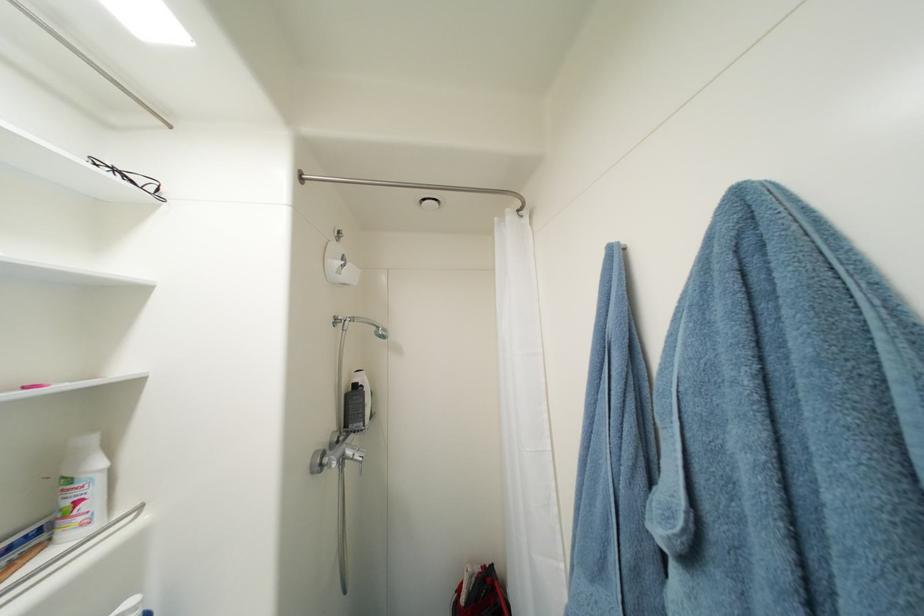
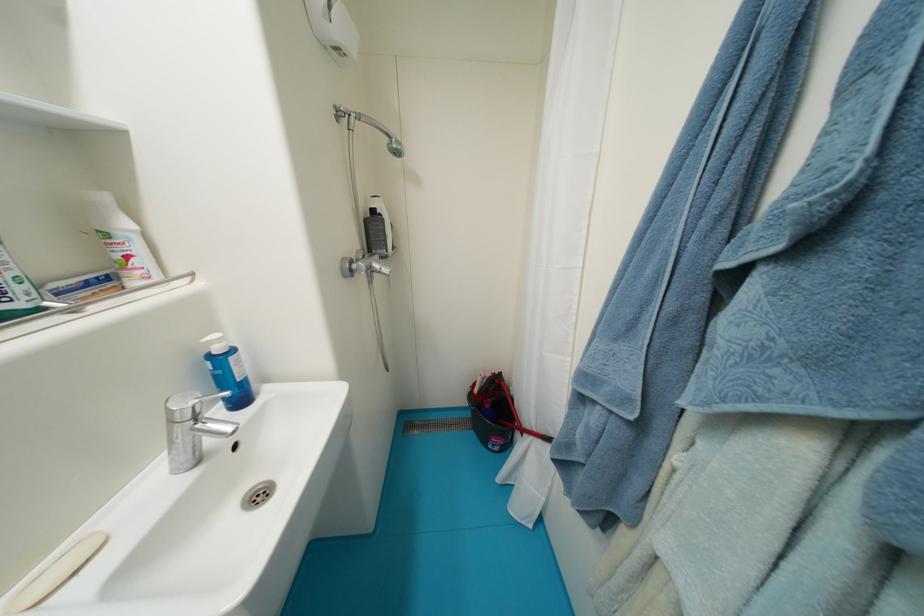
Find the pixel in the second image that matches pixel 356 454 in the first image.

(383, 267)